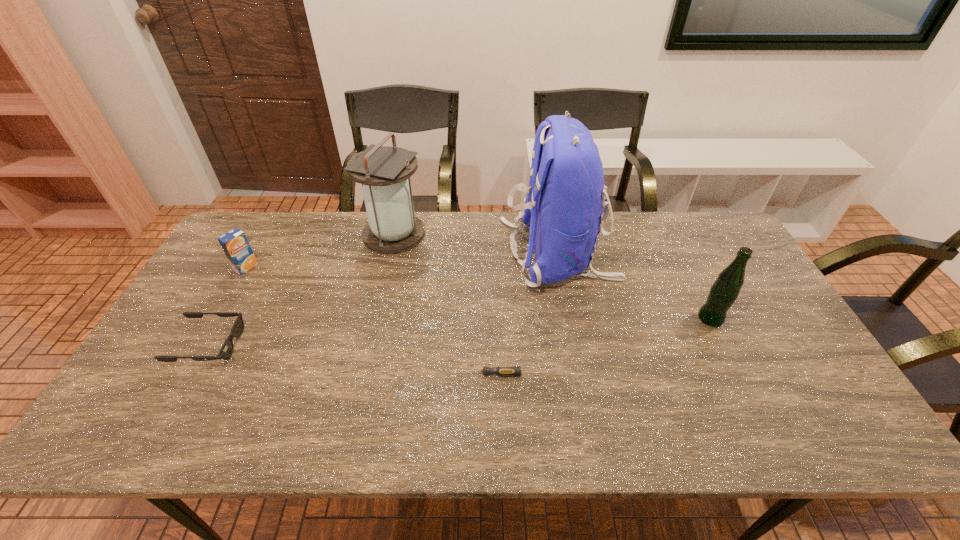
Locate an element on the screen. The width and height of the screenshot is (960, 540). vacant space that's between the tallest object and the shortest object is located at coordinates (522, 313).

The height and width of the screenshot is (540, 960). Identify the location of vacant space that is in between the screwdriver and the orange_juice. (366, 320).

Where is `vacant space that is in between the screwdriver and the fourth shortest object`? This screenshot has height=540, width=960. vacant space that is in between the screwdriver and the fourth shortest object is located at coordinates (598, 346).

Image resolution: width=960 pixels, height=540 pixels. I want to click on empty location between the third tallest object and the nearest object, so click(598, 346).

Locate an element on the screen. The height and width of the screenshot is (540, 960). unoccupied position between the shortest object and the orange_juice is located at coordinates (366, 320).

What are the coordinates of `free space between the tallest object and the beer bottle` in the screenshot? It's located at (635, 286).

Where is `free space between the tallest object and the third object from left to right`? This screenshot has width=960, height=540. free space between the tallest object and the third object from left to right is located at coordinates (476, 244).

I want to click on free spot between the nearest object and the tallest object, so pos(522,313).

Identify which object is the nearest to the beer bottle. Please provide its 2D coordinates. Your answer should be formatted as a tuple, i.e. [(x, y)], where the tuple contains the x and y coordinates of a point satisfying the conditions above.

[(564, 205)]

Image resolution: width=960 pixels, height=540 pixels. Identify the location of object that is the second closest to the tallest object. (501, 370).